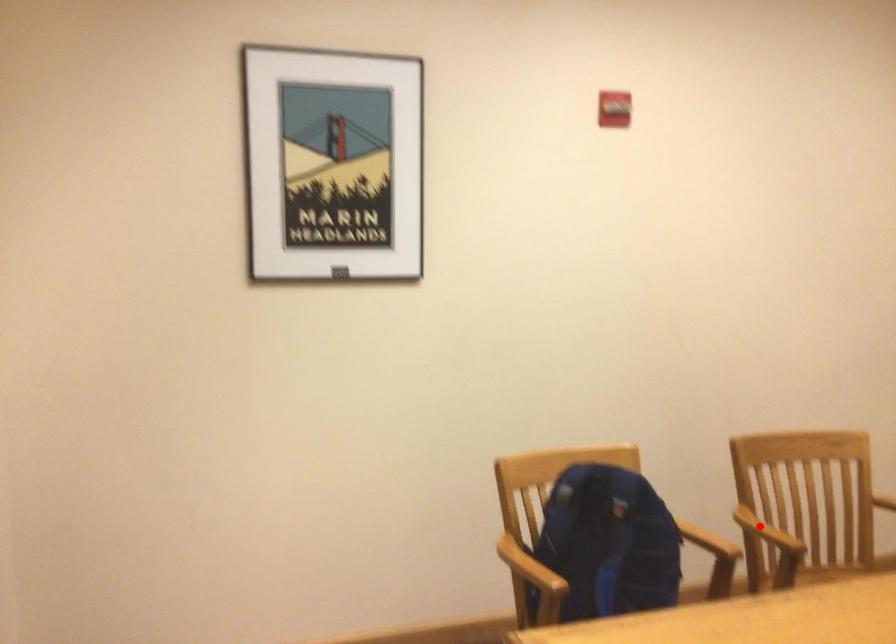
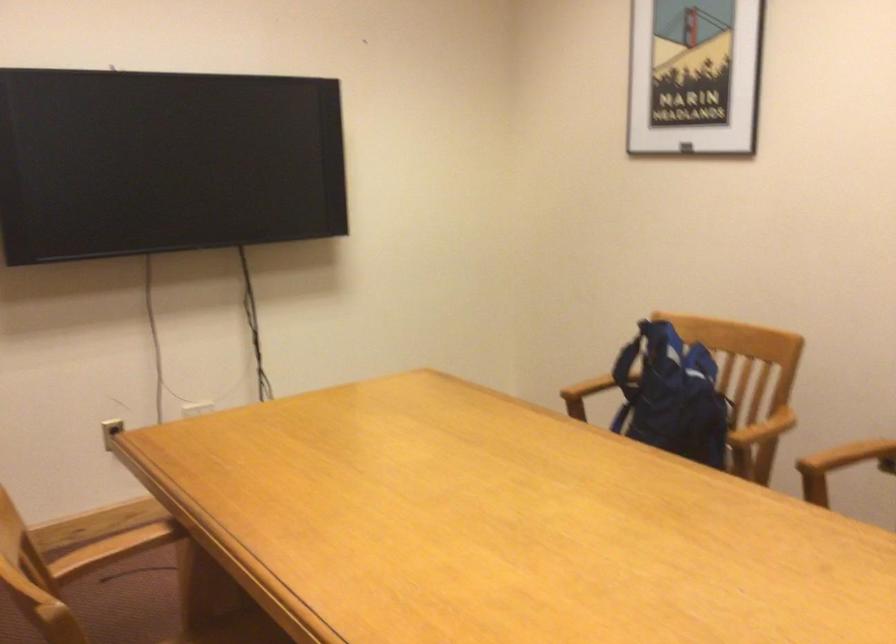
Where in the second image is the point corresponding to the highlighted location from the first image?

(849, 456)